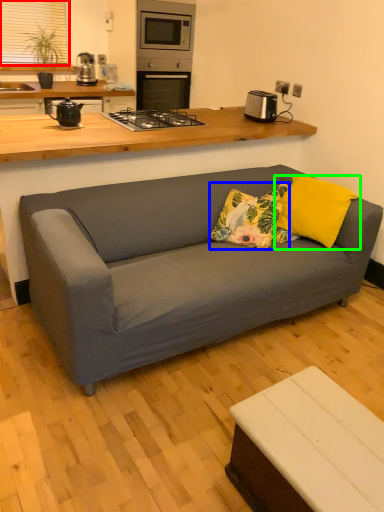
Question: Which object is positioned closest to window screen (highlighted by a red box)? Select from throw pillow (highlighted by a blue box) and pillow (highlighted by a green box).

Choices:
 (A) throw pillow
 (B) pillow

Answer: (A)